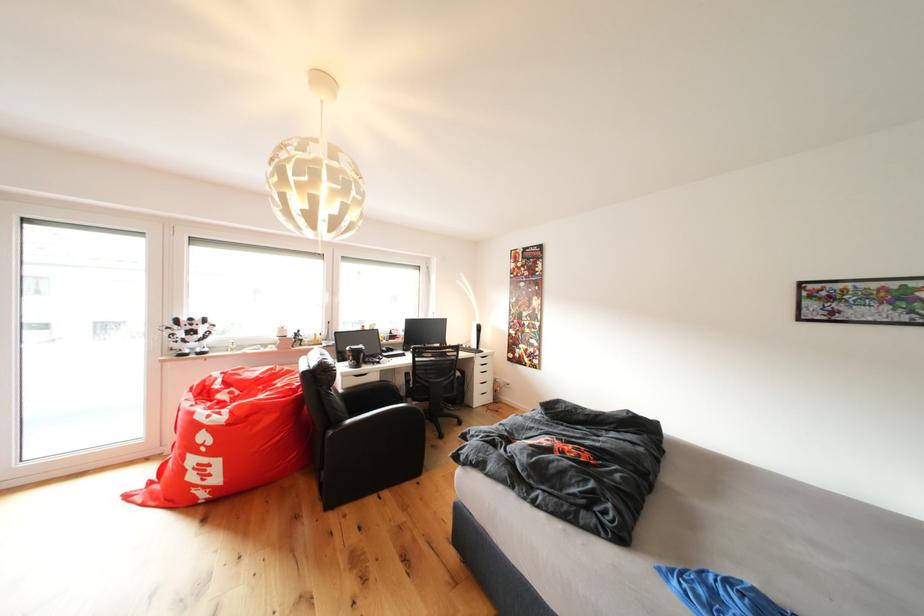
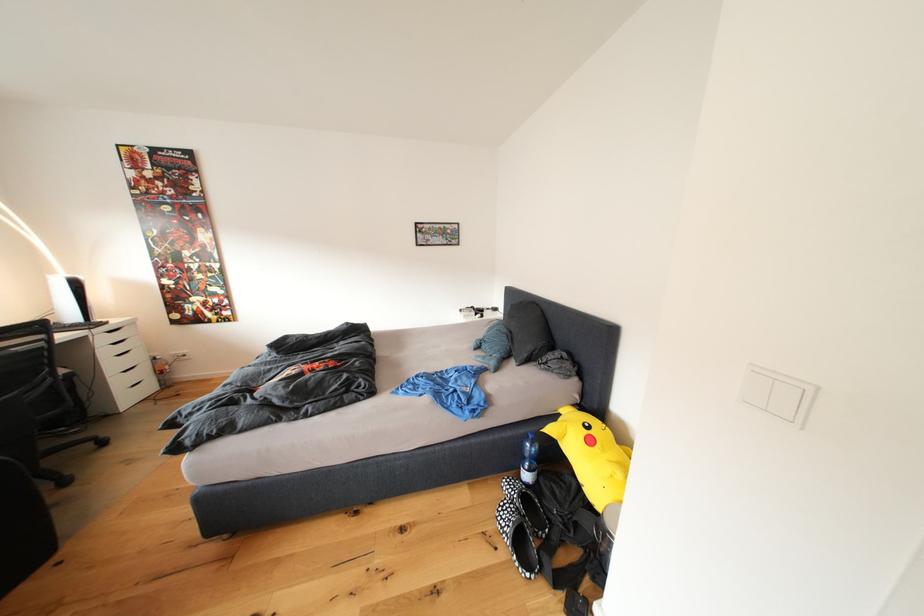
In the second image, find the point that corresponds to (x=497, y=392) in the first image.

(152, 379)